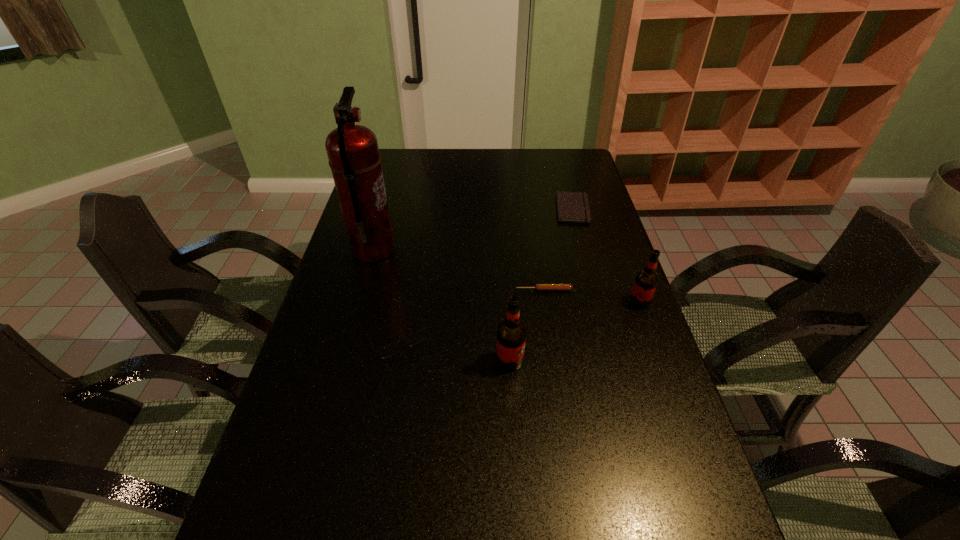
Given the evenly spaced root beers in the image, where should an extra root beer be added on the left to preserve the spacing? Please point to a vacant space. Please provide its 2D coordinates. Your answer should be formatted as a tuple, i.e. [(x, y)], where the tuple contains the x and y coordinates of a point satisfying the conditions above.

[(340, 437)]